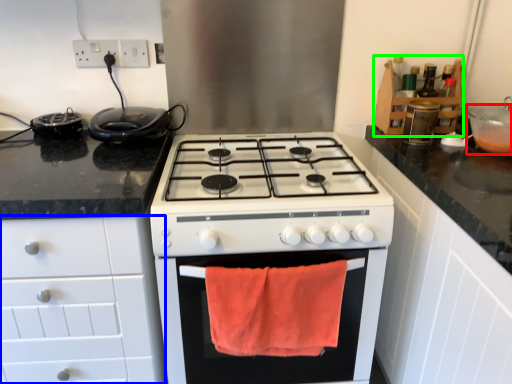
Question: Which object is the farthest from appliance (highlighted by a red box)? Choose among these: cabinetry (highlighted by a blue box) or cabinetry (highlighted by a green box).

Choices:
 (A) cabinetry
 (B) cabinetry

Answer: (A)